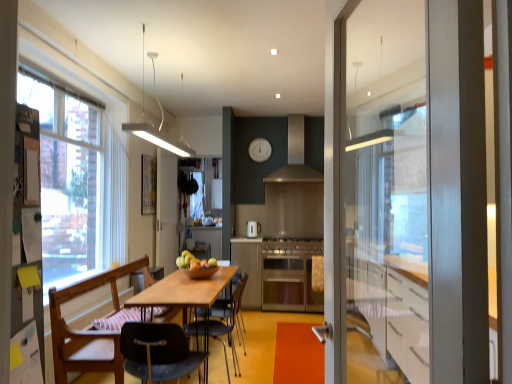
Question: In the image, is wooden chair at left, which appears as the 2th chair when viewed from the front, positioned in front of or behind wooden table at center?

Choices:
 (A) front
 (B) behind

Answer: (A)

Question: In terms of width, does wooden chair at left, marked as the 2th chair in a back-to-front arrangement, look wider or thinner when compared to wooden table at center?

Choices:
 (A) thin
 (B) wide

Answer: (A)

Question: Estimate the real-world distances between objects in this image. Which object is farther from the satin silver oven at center?

Choices:
 (A) clear glass window at left
 (B) wooden chair at left, marked as the 2th chair in a back-to-front arrangement
 (C) wooden table at center
 (D) metallic silver handle at center
 (E) yellow matte apple at center

Answer: (A)

Question: Estimate the real-world distances between objects in this image. Which object is closer to the wooden table at center?

Choices:
 (A) white matte clock at upper center
 (B) stainless steel oven at center
 (C) metallic gray chair at center, the 3th chair positioned from the front
 (D) satin silver exhaust hood at center
 (E) stainless steel stove at center

Answer: (C)